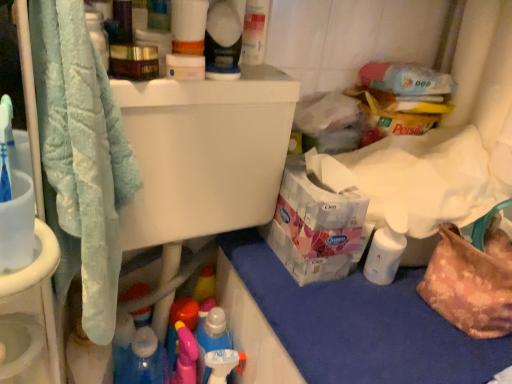
Describe the element at coordinates (223, 41) in the screenshot. The width and height of the screenshot is (512, 384). I see `matte white spray bottle at upper center` at that location.

At what (x,y) coordinates should I click in order to perform the action: click on matte white spray bottle at upper center. Please return your answer as a coordinate pair (x, y). This screenshot has height=384, width=512. Looking at the image, I should click on (223, 41).

From the image's perspective, does matte white spray bottle at upper center appear lower than floral fabric handbag at lower right?

Incorrect, from the image's perspective, matte white spray bottle at upper center is higher than floral fabric handbag at lower right.

Does matte white spray bottle at upper center turn towards floral fabric handbag at lower right?

No, matte white spray bottle at upper center does not turn towards floral fabric handbag at lower right.

The width and height of the screenshot is (512, 384). I want to click on handbag on the right of matte white spray bottle at upper center, so click(x=472, y=278).

Is matte white spray bottle at upper center with floral fabric handbag at lower right?

There is a gap between matte white spray bottle at upper center and floral fabric handbag at lower right.

Is white glossy lotion at lower right not close to blue fabric at lower right?

white glossy lotion at lower right is actually quite close to blue fabric at lower right.

Is white glossy lotion at lower right oriented away from blue fabric at lower right?

No, white glossy lotion at lower right is not facing the opposite direction of blue fabric at lower right.

From a real-world perspective, which is physically below, white glossy lotion at lower right or blue fabric at lower right?

blue fabric at lower right.

Which is behind, white glossy lotion at lower right or blue fabric at lower right?

white glossy lotion at lower right is behind.

What are the coordinates of `counter top below the matte white spray bottle at upper center (from a real-world perspective)` in the screenshot? It's located at (361, 325).

Which is correct: blue fabric at lower right is inside matte white spray bottle at upper center, or outside of it?

blue fabric at lower right is spatially situated outside matte white spray bottle at upper center.

Is blue fabric at lower right beside matte white spray bottle at upper center?

No, blue fabric at lower right is not making contact with matte white spray bottle at upper center.

From the image's perspective, is white glossy lotion at lower right on top of soft blue towel at left?

No, from the image's perspective, white glossy lotion at lower right is not on top of soft blue towel at left.

Who is taller, white glossy lotion at lower right or soft blue towel at left?

With more height is soft blue towel at left.

Is white glossy lotion at lower right in front of or behind soft blue towel at left in the image?

white glossy lotion at lower right is behind soft blue towel at left.

Is there a large distance between matte white spray bottle at upper center and blue fabric at lower right?

matte white spray bottle at upper center is near blue fabric at lower right, not far away.

Considering the relative positions of matte white spray bottle at upper center and blue fabric at lower right in the image provided, is matte white spray bottle at upper center in front of blue fabric at lower right?

That is False.

Between matte white spray bottle at upper center and blue fabric at lower right, which one has less height?

blue fabric at lower right is shorter.

From a real-world perspective, is blue fabric at lower right over soft blue towel at left?

No, from a real-world perspective, blue fabric at lower right is not above soft blue towel at left.

Are blue fabric at lower right and soft blue towel at left far apart?

blue fabric at lower right is actually quite close to soft blue towel at left.

Who is more distant, blue fabric at lower right or soft blue towel at left?

blue fabric at lower right is more distant.

From the image's perspective, would you say blue fabric at lower right is positioned over soft blue towel at left?

No, from the image's perspective, blue fabric at lower right is not above soft blue towel at left.

Is floral fabric handbag at lower right closer to camera compared to white glossy lotion at lower right?

That is True.

From a real-world perspective, is floral fabric handbag at lower right physically above white glossy lotion at lower right?

Yes.

Based on the photo, from the image's perspective, is floral fabric handbag at lower right over white glossy lotion at lower right?

Incorrect, from the image's perspective, floral fabric handbag at lower right is lower than white glossy lotion at lower right.

Is floral fabric handbag at lower right inside or outside of white glossy lotion at lower right?

floral fabric handbag at lower right is outside white glossy lotion at lower right.

Identify the location of cleaning product that appears above the floral fabric handbag at lower right (from the image's perspective). [x=223, y=41].

At what (x,y) coordinates should I click in order to perform the action: click on counter top in front of the white glossy lotion at lower right. Please return your answer as a coordinate pair (x, y). Looking at the image, I should click on (361, 325).

Considering their positions, is white glossy lotion at lower right positioned further to floral fabric handbag at lower right than blue fabric at lower right?

blue fabric at lower right is positioned further to the anchor floral fabric handbag at lower right.

Looking at the image, which one is located further to matte white spray bottle at upper center, blue fabric at lower right or soft blue towel at left?

blue fabric at lower right is further to matte white spray bottle at upper center.

When comparing their distances from matte white spray bottle at upper center, does floral fabric handbag at lower right or blue fabric at lower right seem further?

Based on the image, floral fabric handbag at lower right appears to be further to matte white spray bottle at upper center.

Estimate the real-world distances between objects in this image. Which object is further from blue fabric at lower right, soft blue towel at left or floral fabric handbag at lower right?

The object further to blue fabric at lower right is soft blue towel at left.

Based on their spatial positions, is floral fabric handbag at lower right or blue fabric at lower right further from soft blue towel at left?

floral fabric handbag at lower right is further to soft blue towel at left.

Estimate the real-world distances between objects in this image. Which object is further from blue fabric at lower right, white glossy lotion at lower right or soft blue towel at left?

Among the two, soft blue towel at left is located further to blue fabric at lower right.

Which object lies nearer to the anchor point white glossy lotion at lower right, soft blue towel at left or floral fabric handbag at lower right?

floral fabric handbag at lower right is positioned closer to the anchor white glossy lotion at lower right.

Based on their spatial positions, is matte white spray bottle at upper center or blue fabric at lower right further from white glossy lotion at lower right?

matte white spray bottle at upper center.

Where is `counter top between soft blue towel at left and white glossy lotion at lower right from left to right`? This screenshot has height=384, width=512. counter top between soft blue towel at left and white glossy lotion at lower right from left to right is located at coordinates (361, 325).

Find the location of a particular element. The height and width of the screenshot is (384, 512). handbag between matte white spray bottle at upper center and blue fabric at lower right in the up-down direction is located at coordinates (472, 278).

Image resolution: width=512 pixels, height=384 pixels. Identify the location of counter top between soft blue towel at left and floral fabric handbag at lower right from left to right. (361, 325).

Identify the location of cleaning product located between soft blue towel at left and floral fabric handbag at lower right in the left-right direction. (223, 41).